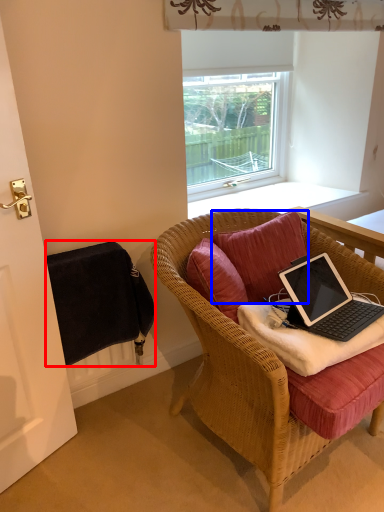
Question: Which object appears farthest to the camera in this image, radiator (highlighted by a red box) or pillow (highlighted by a blue box)?

Choices:
 (A) radiator
 (B) pillow

Answer: (B)